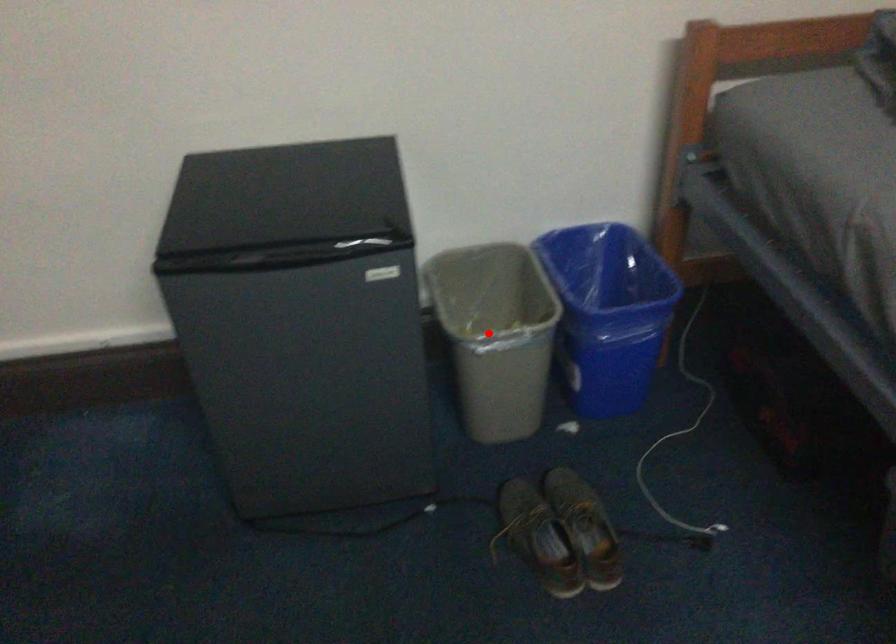
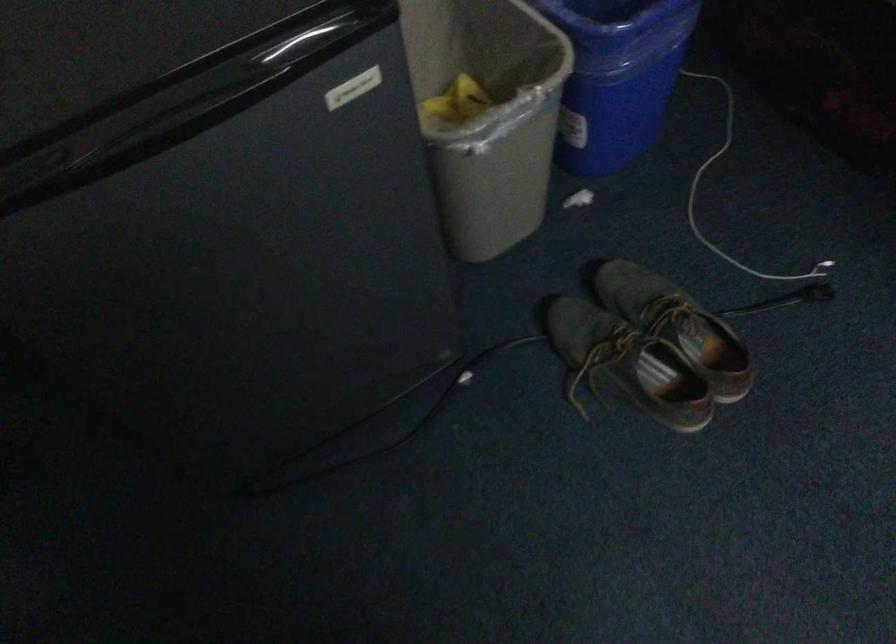
Find the pixel in the second image that matches the highlighted location in the first image.

(487, 115)